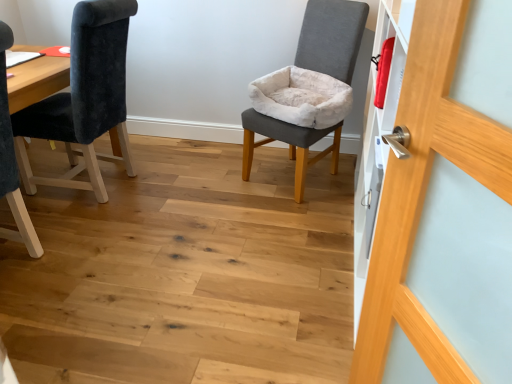
The width and height of the screenshot is (512, 384). I want to click on vacant space in gray fabric chair at center, the 1th chair viewed from the right (from a real-world perspective), so click(291, 179).